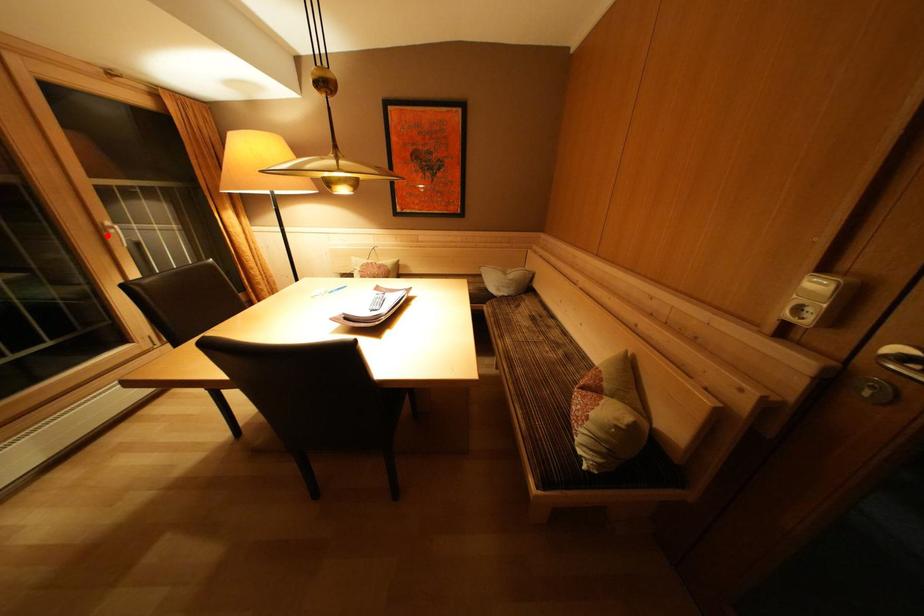
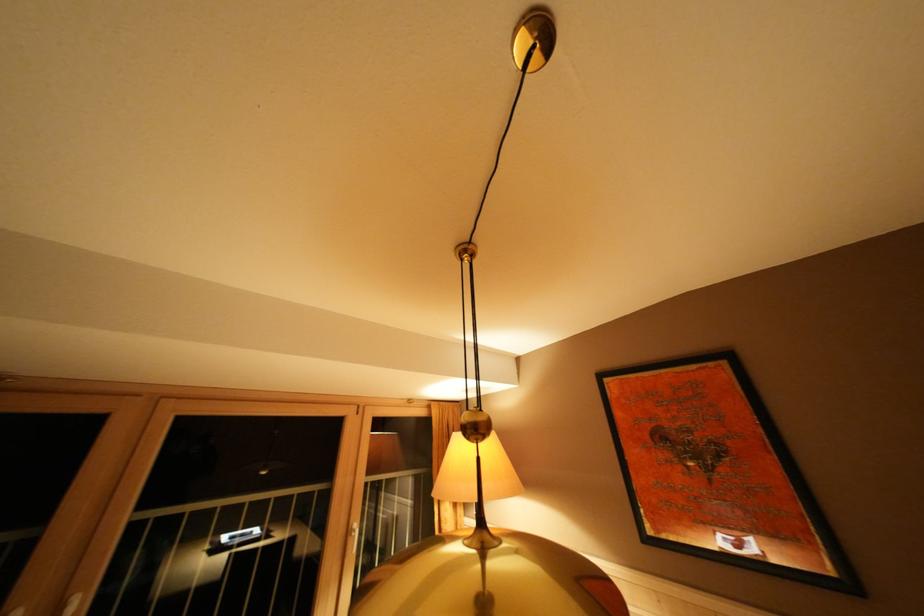
Locate, in the second image, the point that corresponds to the highlighted location in the first image.

(355, 537)